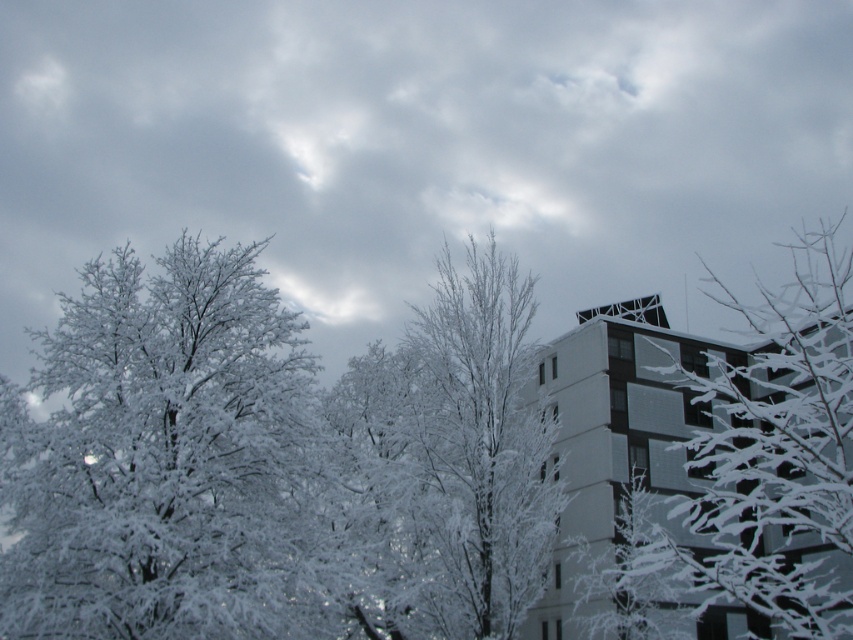
Question: Is white frosty tree at center wider than white frosted branches at upper right?

Choices:
 (A) yes
 (B) no

Answer: (B)

Question: Which is nearer to the white frosty tree at left?

Choices:
 (A) cloudy at upper center
 (B) white frosted branches at upper right
 (C) white frosty tree at center

Answer: (C)

Question: Which point appears farthest from the camera in this image?

Choices:
 (A) (405, 362)
 (B) (177, 408)
 (C) (473, 93)

Answer: (C)

Question: Does cloudy at upper center have a larger size compared to white frosty tree at center?

Choices:
 (A) yes
 (B) no

Answer: (A)

Question: From the image, what is the correct spatial relationship of white frosty tree at left in relation to white frosty tree at center?

Choices:
 (A) right
 (B) left

Answer: (B)

Question: Which point is farther from the camera taking this photo?

Choices:
 (A) (96, 368)
 (B) (728, 593)

Answer: (A)